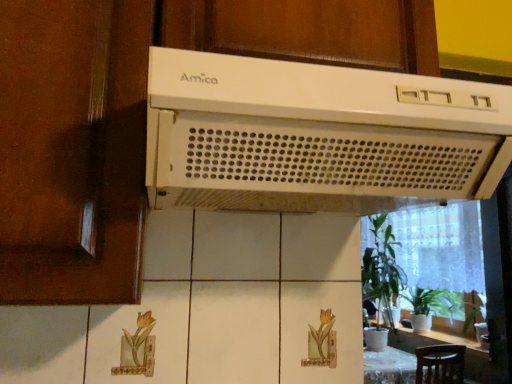
Question: Considering the relative positions of green glossy houseplant at lower right, which is the 1th houseplant in right-to-left order, and matte brown screen door at left in the image provided, is green glossy houseplant at lower right, which is the 1th houseplant in right-to-left order, to the right of matte brown screen door at left from the viewer's perspective?

Choices:
 (A) yes
 (B) no

Answer: (A)

Question: From a real-world perspective, is green glossy houseplant at lower right, positioned as the 2th houseplant in left-to-right order, on top of matte brown screen door at left?

Choices:
 (A) yes
 (B) no

Answer: (B)

Question: Is green glossy houseplant at lower right, positioned as the 2th houseplant in left-to-right order, taller than matte brown screen door at left?

Choices:
 (A) yes
 (B) no

Answer: (B)

Question: Considering the relative sizes of green glossy houseplant at lower right, positioned as the 2th houseplant in left-to-right order, and matte brown screen door at left in the image provided, is green glossy houseplant at lower right, positioned as the 2th houseplant in left-to-right order, smaller than matte brown screen door at left?

Choices:
 (A) yes
 (B) no

Answer: (A)

Question: From the image's perspective, is green glossy houseplant at lower right, which is the 1th houseplant in right-to-left order, over matte brown screen door at left?

Choices:
 (A) no
 (B) yes

Answer: (A)

Question: From the image's perspective, is white plastic range hood at upper center positioned above or below matte brown screen door at left?

Choices:
 (A) above
 (B) below

Answer: (B)

Question: From their relative heights in the image, would you say white plastic range hood at upper center is taller or shorter than matte brown screen door at left?

Choices:
 (A) short
 (B) tall

Answer: (A)

Question: From a real-world perspective, is white plastic range hood at upper center physically located above or below matte brown screen door at left?

Choices:
 (A) below
 (B) above

Answer: (A)

Question: Based on their positions, is white plastic range hood at upper center located to the left or right of matte brown screen door at left?

Choices:
 (A) right
 (B) left

Answer: (A)

Question: Considering their positions, is white plastic amica range hood at upper center located in front of or behind white plastic range hood at upper center?

Choices:
 (A) front
 (B) behind

Answer: (B)

Question: Choose the correct answer: Is white plastic amica range hood at upper center inside white plastic range hood at upper center or outside it?

Choices:
 (A) inside
 (B) outside

Answer: (B)

Question: Considering the positions of point (409, 11) and point (385, 125), is point (409, 11) closer or farther from the camera than point (385, 125)?

Choices:
 (A) closer
 (B) farther

Answer: (B)

Question: From a real-world perspective, is white plastic amica range hood at upper center positioned above or below white plastic range hood at upper center?

Choices:
 (A) above
 (B) below

Answer: (A)

Question: Looking at the image, does matte brown screen door at left seem bigger or smaller compared to green leafy plant at right, arranged as the 1th houseplant when viewed from the left?

Choices:
 (A) big
 (B) small

Answer: (B)

Question: Considering the positions of point (47, 198) and point (381, 261), is point (47, 198) closer or farther from the camera than point (381, 261)?

Choices:
 (A) closer
 (B) farther

Answer: (A)